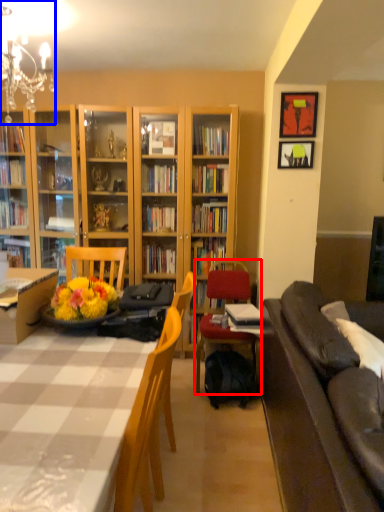
Question: Which object is closer to the camera taking this photo, chair (highlighted by a red box) or lamp (highlighted by a blue box)?

Choices:
 (A) chair
 (B) lamp

Answer: (B)